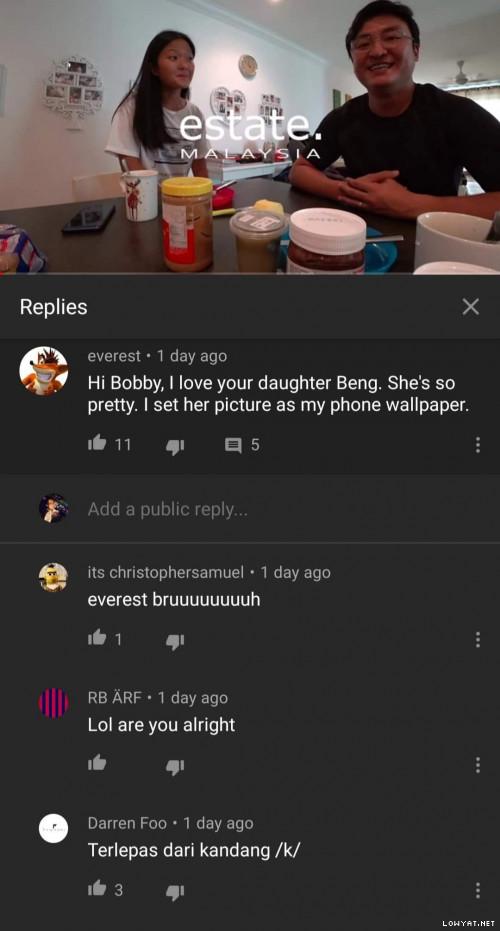
You are a GUI agent. You are given a task and a screenshot of the screen. Output one action in this format:
    pyautogui.click(x=<x>, y=<y>)
    Task: Click on the pictures
    
    Given the screenshot: What is the action you would take?
    pyautogui.click(x=234, y=104)